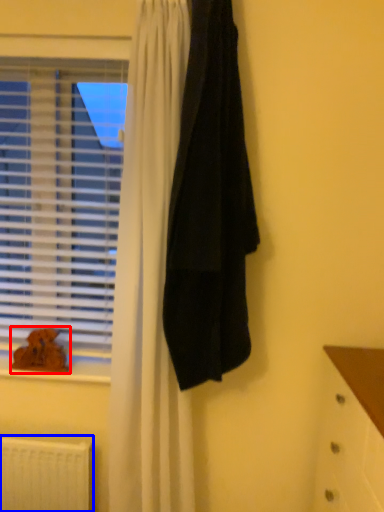
Question: Which of the following is the closest to the observer, animal (highlighted by a red box) or radiator (highlighted by a blue box)?

Choices:
 (A) animal
 (B) radiator

Answer: (B)